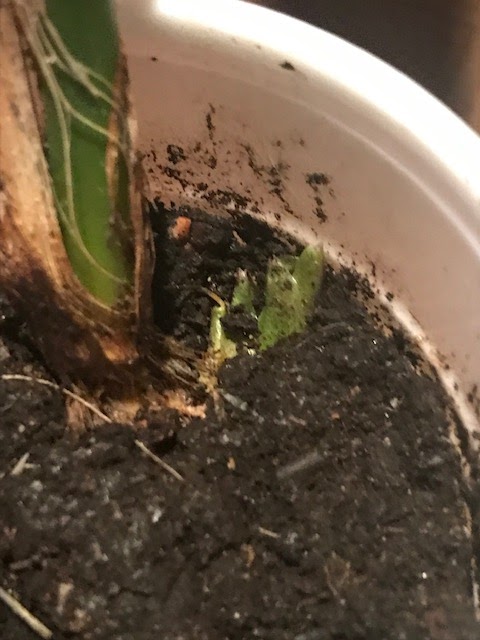
What are the coordinates of `rim of plant pot` in the screenshot? It's located at click(191, 42).